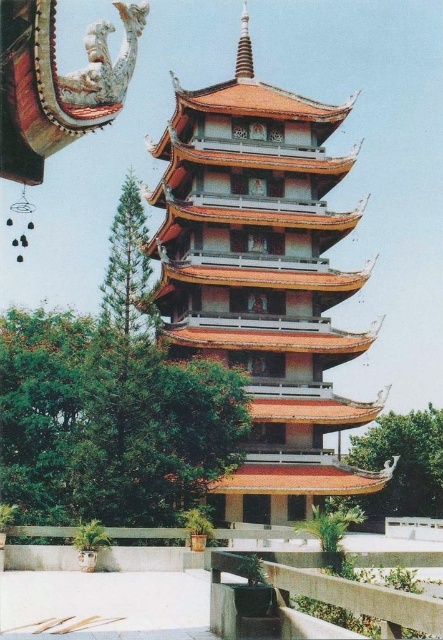
Is point (170, 225) more distant than point (283, 604)?

Yes, it is.

Which is behind, point (230, 88) or point (249, 588)?

Positioned behind is point (230, 88).

Find the location of a particular element. This screenshot has height=640, width=443. orange tiled tower at center is located at coordinates (263, 280).